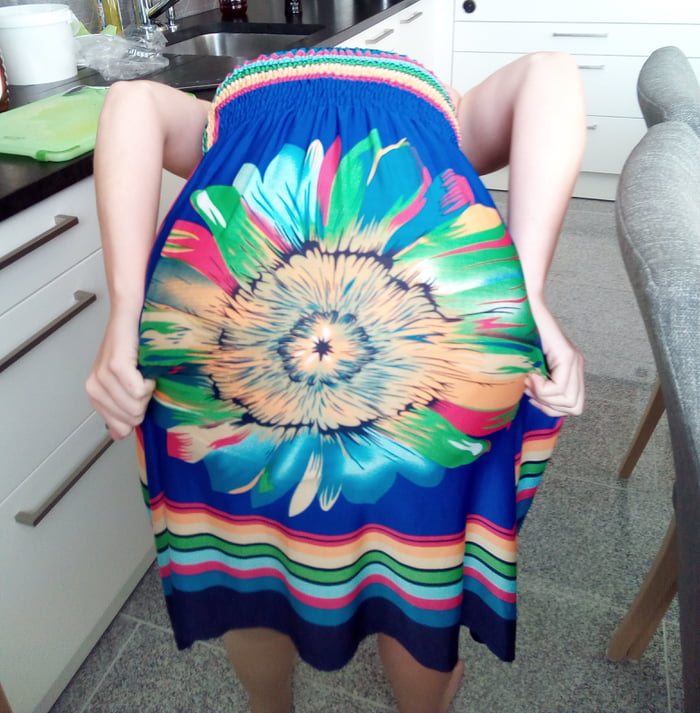
What are the coordinates of `floor` in the screenshot? It's located at 535,593.